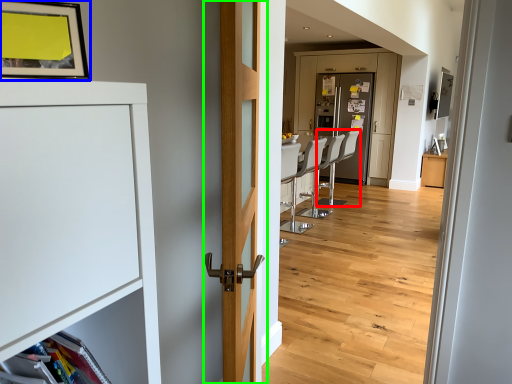
Question: Which object is positioned closest to armchair (highlighted by a red box)? Select from picture frame (highlighted by a blue box) and door (highlighted by a green box).

Choices:
 (A) picture frame
 (B) door

Answer: (B)